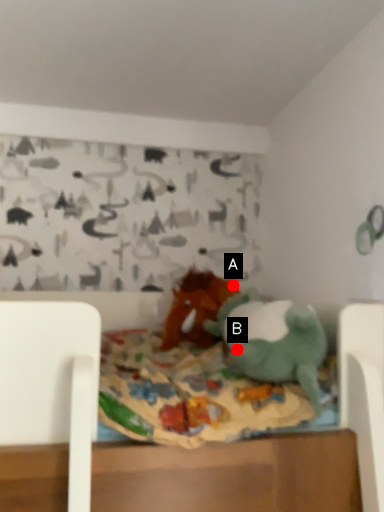
Question: Two points are circled on the image, labeled by A and B beside each circle. Which point is closer to the camera?

Choices:
 (A) A is closer
 (B) B is closer

Answer: (B)